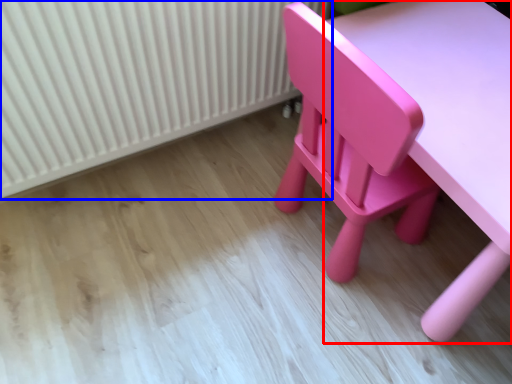
Question: Which of the following is the closest to the observer, table (highlighted by a red box) or radiator (highlighted by a blue box)?

Choices:
 (A) table
 (B) radiator

Answer: (A)